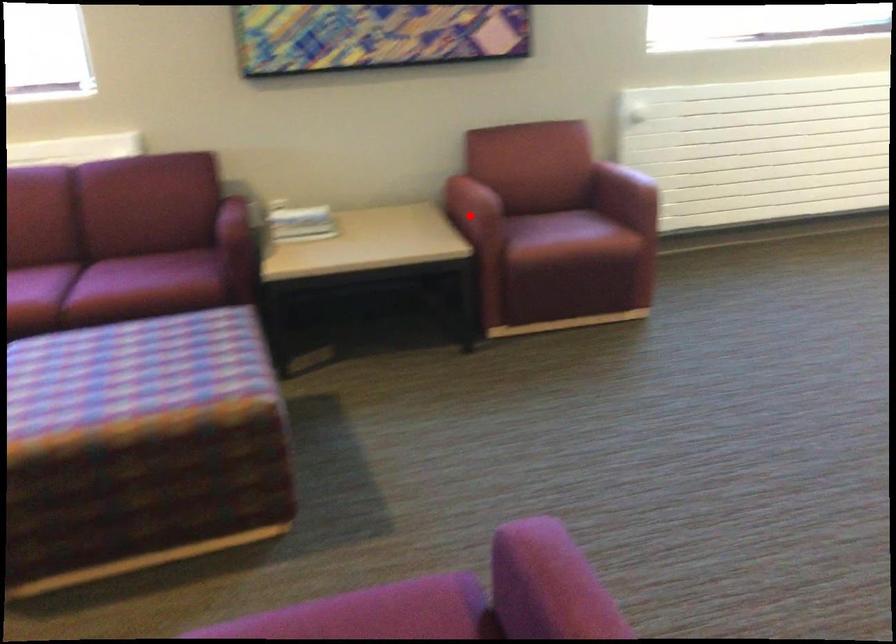
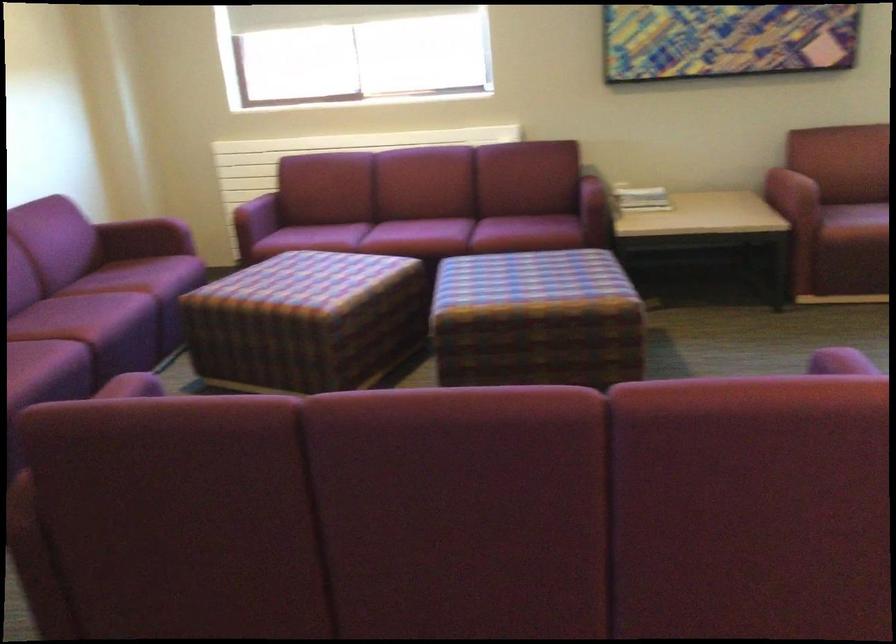
Question: A red point is marked in image1. In image2, is the corresponding 3D point closer to the camera or farther? Reply with the corresponding letter.

Choices:
 (A) The corresponding 3D point is closer.
 (B) The corresponding 3D point is farther.

Answer: (B)